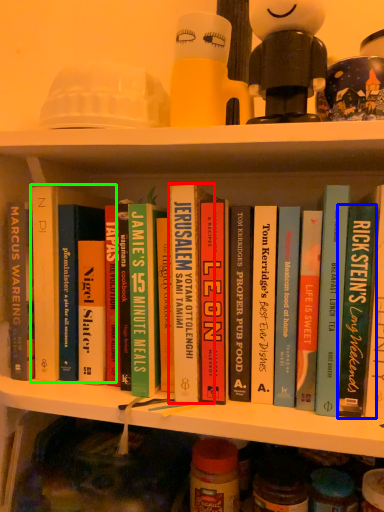
Question: Considering the real-world distances, which object is closest to book (highlighted by a red box)? book (highlighted by a blue box) or book (highlighted by a green box).

Choices:
 (A) book
 (B) book

Answer: (B)